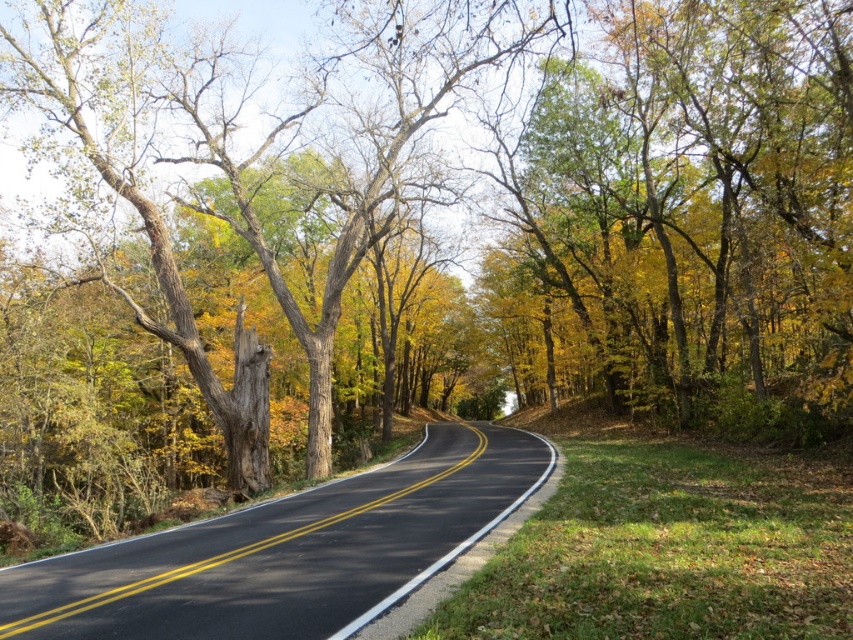
Question: Does smooth bark tree at center appear under black asphalt highway at center?

Choices:
 (A) no
 (B) yes

Answer: (A)

Question: Which object is positioned closest to the green leafy tree at upper right?

Choices:
 (A) smooth bark tree at center
 (B) black asphalt highway at center

Answer: (A)

Question: Does smooth bark tree at center have a greater width compared to black asphalt highway at center?

Choices:
 (A) no
 (B) yes

Answer: (B)

Question: Which of the following is the closest to the observer?

Choices:
 (A) 175,586
 (B) 729,230
 (C) 194,186

Answer: (A)

Question: Does green leafy tree at upper right appear on the right side of smooth bark tree at center?

Choices:
 (A) no
 (B) yes

Answer: (B)

Question: Which point is closer to the camera?

Choices:
 (A) black asphalt highway at center
 (B) smooth bark tree at center
 (C) green leafy tree at upper right

Answer: (A)